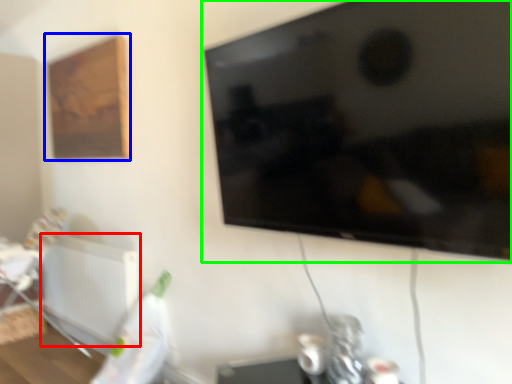
Question: Based on their relative distances, which object is nearer to radiator (highlighted by a red box)? Choose from picture frame (highlighted by a blue box) and television (highlighted by a green box).

Choices:
 (A) picture frame
 (B) television

Answer: (A)